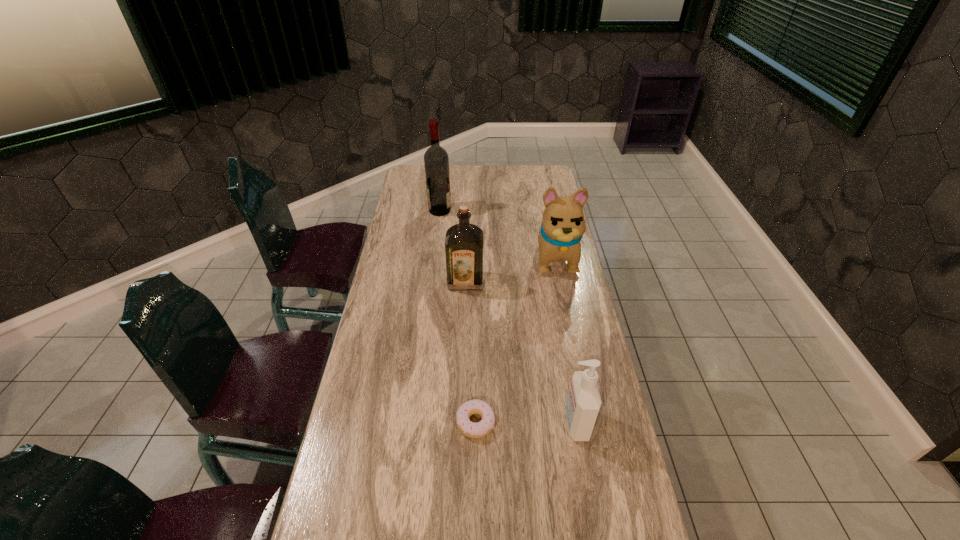
Where is `free space located on the front label of the cleansing agent`? free space located on the front label of the cleansing agent is located at coordinates (435, 423).

I want to click on free space located on the front label of the cleansing agent, so click(464, 423).

The image size is (960, 540). What are the coordinates of `vacant area located on the left of the shortest object` in the screenshot? It's located at (346, 422).

Locate an element on the screen. The width and height of the screenshot is (960, 540). object at the left edge is located at coordinates (436, 161).

The height and width of the screenshot is (540, 960). What are the coordinates of `puppy that is at the right edge` in the screenshot? It's located at (563, 225).

Locate an element on the screen. This screenshot has width=960, height=540. cleansing agent that is at the right edge is located at coordinates (583, 404).

Identify the location of vacant space at the far edge. This screenshot has width=960, height=540. (518, 170).

You are a GUI agent. You are given a task and a screenshot of the screen. Output one action in this format:
    pyautogui.click(x=<x>, y=<y>)
    Task: Click on the vacant region at the left edge
    The width and height of the screenshot is (960, 540).
    Given the screenshot: What is the action you would take?
    pyautogui.click(x=393, y=302)

This screenshot has width=960, height=540. In order to click on vacant space at the right edge of the desktop in this screenshot , I will do `click(600, 379)`.

At what (x,y) coordinates should I click in order to perform the action: click on empty space between the doughnut and the fourth tallest object. Please return your answer as a coordinate pair (x, y). Looking at the image, I should click on (526, 423).